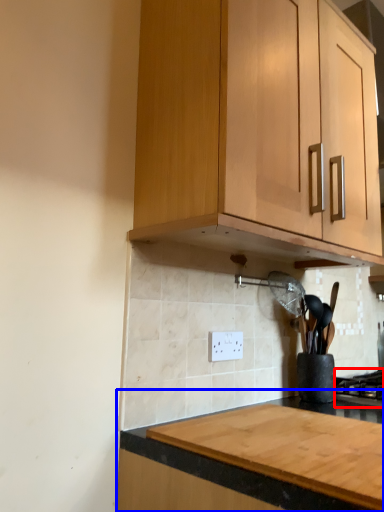
Question: Which object appears farthest to the camera in this image, gas stove (highlighted by a red box) or countertop (highlighted by a blue box)?

Choices:
 (A) gas stove
 (B) countertop

Answer: (A)